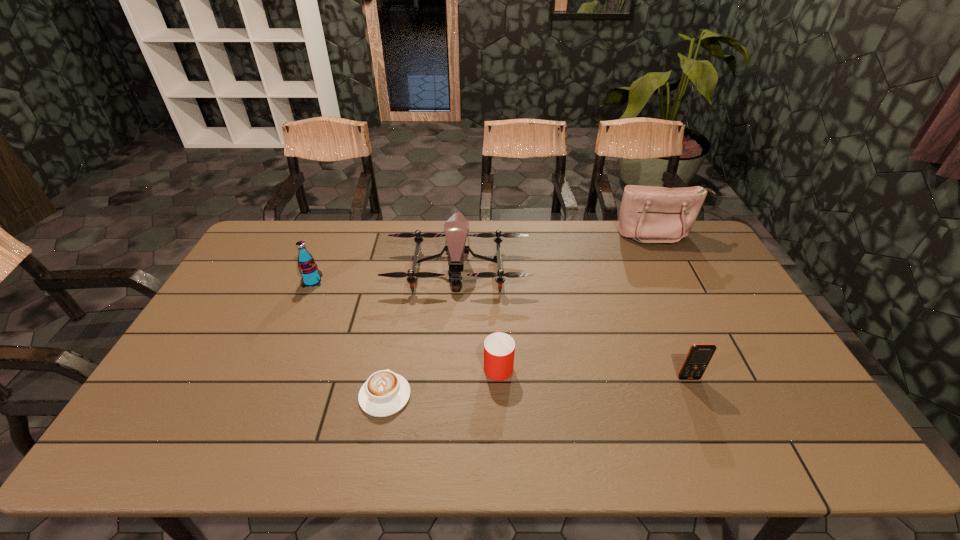
At what (x,y) coordinates should I click in order to perform the action: click on empty location between the second shortest object and the drone. Please return your answer as a coordinate pair (x, y). The width and height of the screenshot is (960, 540). Looking at the image, I should click on (478, 316).

This screenshot has height=540, width=960. I want to click on vacant region between the leftmost object and the fourth tallest object, so pos(500,329).

Identify the location of vacant space that's between the third shortest object and the fifth tallest object. The height and width of the screenshot is (540, 960). (593, 371).

Locate an element on the screen. The width and height of the screenshot is (960, 540). free space between the cup and the cappuccino is located at coordinates (442, 380).

Identify the location of free space between the shortest object and the drone. The height and width of the screenshot is (540, 960). [421, 332].

Where is `empty space that is in between the drone and the shortest object`? This screenshot has height=540, width=960. empty space that is in between the drone and the shortest object is located at coordinates (421, 332).

Image resolution: width=960 pixels, height=540 pixels. What are the coordinates of `object that is the closest to the cup` in the screenshot? It's located at (385, 393).

At what (x,y) coordinates should I click in order to perform the action: click on object that ranks as the fourth closest to the shoulder bag. Please return your answer as a coordinate pair (x, y). The width and height of the screenshot is (960, 540). Looking at the image, I should click on (385, 393).